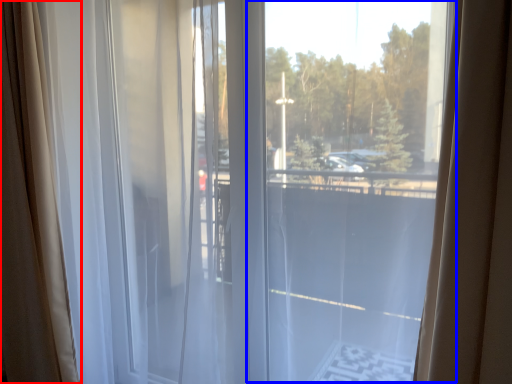
Question: Which point is closer to the camera, curtain (highlighted by a red box) or glass window (highlighted by a blue box)?

Choices:
 (A) curtain
 (B) glass window

Answer: (B)